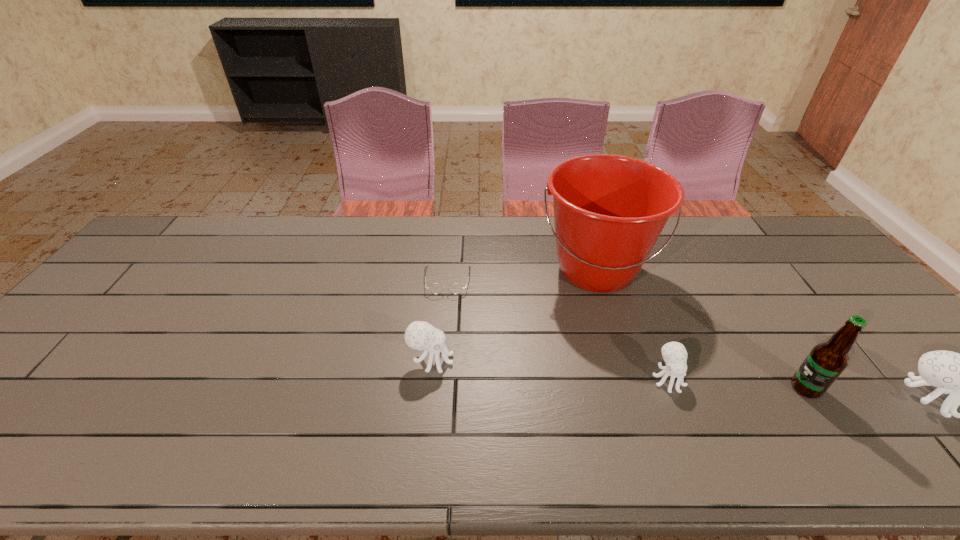
Where is `the fourth tallest object`? Image resolution: width=960 pixels, height=540 pixels. the fourth tallest object is located at coordinates (419, 335).

The height and width of the screenshot is (540, 960). What are the coordinates of `the second shortest octopus` in the screenshot? It's located at (419, 335).

Where is `the shortest octopus`? The image size is (960, 540). the shortest octopus is located at coordinates (674, 354).

In order to click on the second octopus from left to right in this screenshot , I will do `click(674, 354)`.

I want to click on the shortest object, so click(x=435, y=288).

At what (x,y) coordinates should I click in order to perform the action: click on bucket. Please return your answer as a coordinate pair (x, y). Looking at the image, I should click on (609, 211).

This screenshot has width=960, height=540. Identify the location of the fifth shortest object. [x=826, y=361].

Identify the location of beer bottle. This screenshot has height=540, width=960. (826, 361).

This screenshot has width=960, height=540. In order to click on free space located 0.140m on the front-facing side of the leftmost octopus in this screenshot , I will do `click(510, 360)`.

The height and width of the screenshot is (540, 960). I want to click on free space located on the front-facing side of the second shortest object, so pyautogui.click(x=682, y=414).